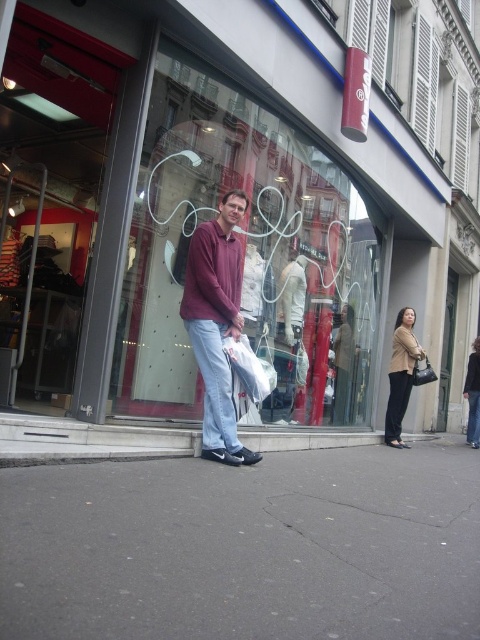
Question: Is transparent glass shop window at center further to the viewer compared to white plastic shopping bag at center?

Choices:
 (A) yes
 (B) no

Answer: (B)

Question: Which of the following is the closest to the observer?

Choices:
 (A) gray concrete curb at lower center
 (B) transparent glass shop window at center
 (C) white plastic shopping bag at center
 (D) maroon fleece sweatshirt at center

Answer: (A)

Question: Among these points, which one is nearest to the camera?

Choices:
 (A) (135, 449)
 (B) (220, 248)

Answer: (A)

Question: Which of the following is the closest to the observer?

Choices:
 (A) white plastic shopping bag at center
 (B) gray asphalt at center

Answer: (B)

Question: Does gray concrete curb at lower center lie behind white plastic shopping bag at center?

Choices:
 (A) yes
 (B) no

Answer: (B)

Question: Does maroon fleece sweatshirt at center have a smaller size compared to white plastic shopping bag at center?

Choices:
 (A) no
 (B) yes

Answer: (A)